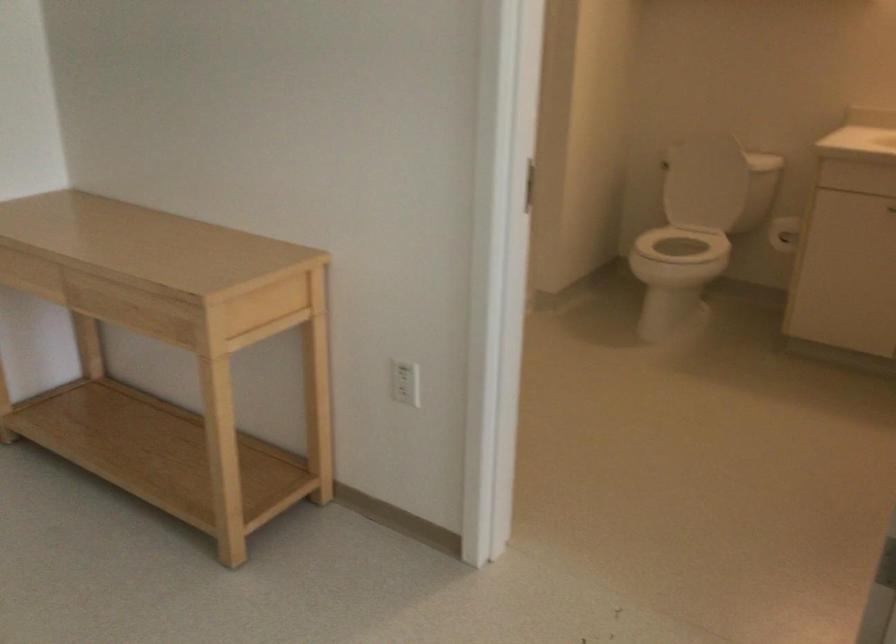
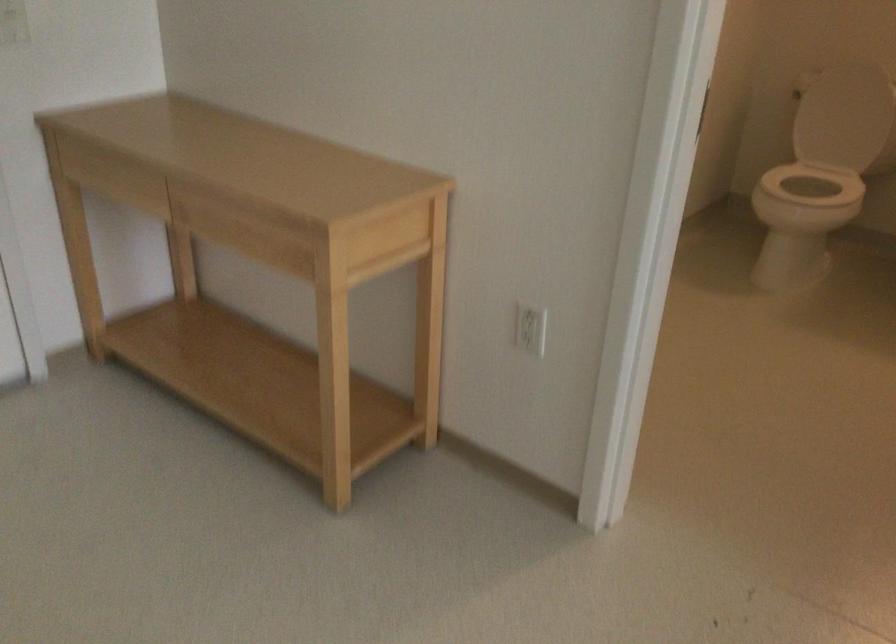
Where in the second image is the point corresponding to the point at 675,245 from the first image?

(814, 184)